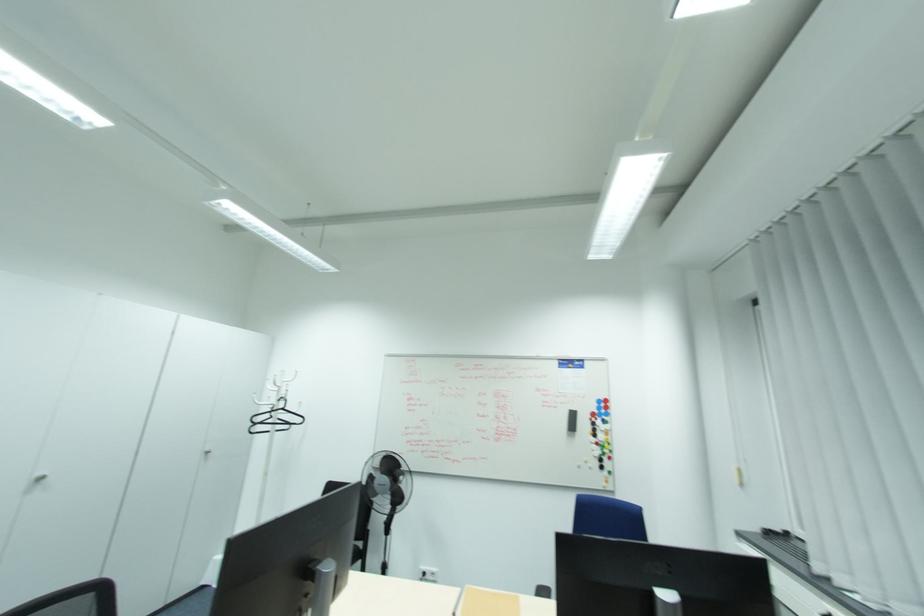
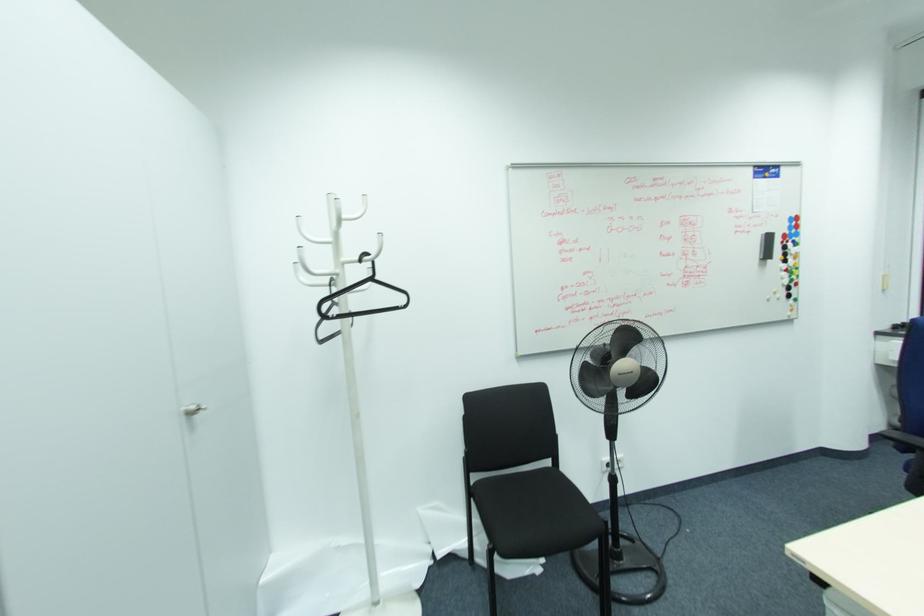
Find the pixel in the second image that matches (593,424) in the first image.

(785, 248)